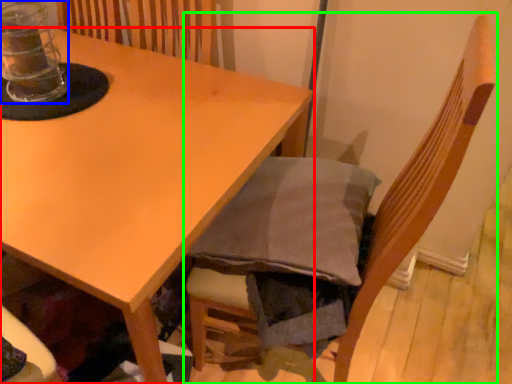
Question: Based on their relative distances, which object is farther from table (highlighted by a red box)? Choose from glass jar (highlighted by a blue box) and chair (highlighted by a green box).

Choices:
 (A) glass jar
 (B) chair

Answer: (B)